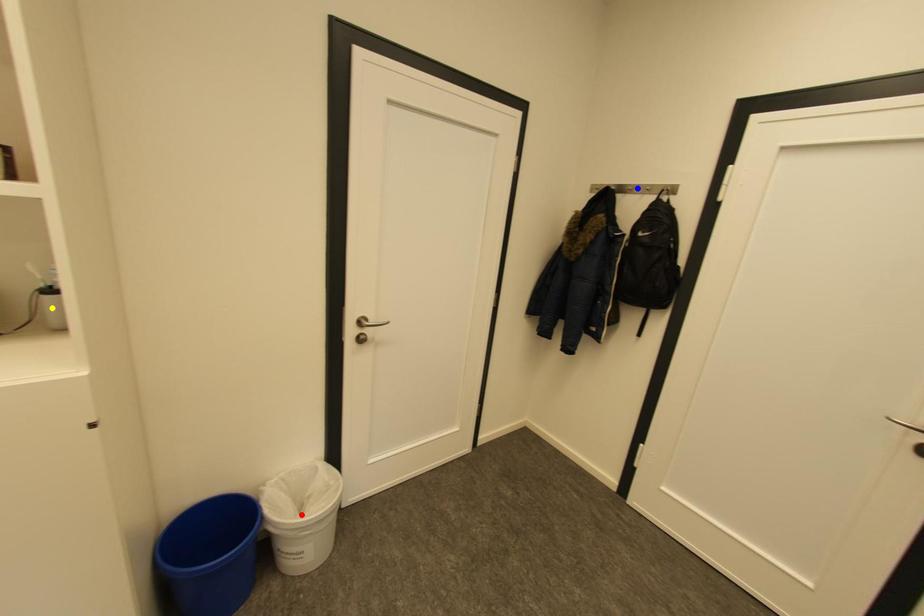
Order these from nearest to farthest:
1. red point
2. blue point
3. yellow point

blue point < red point < yellow point